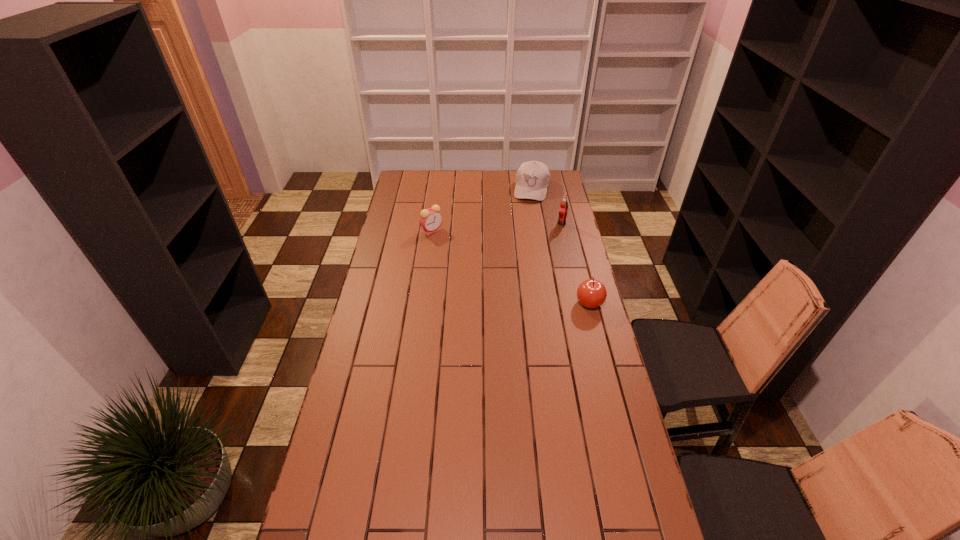
Where is `vacant space located 0.240m on the front-facing side of the baseball cap`? This screenshot has height=540, width=960. vacant space located 0.240m on the front-facing side of the baseball cap is located at coordinates (524, 230).

Where is `free location located on the front-facing side of the baseball cap`? The image size is (960, 540). free location located on the front-facing side of the baseball cap is located at coordinates (519, 248).

Where is `object that is at the far edge`? The width and height of the screenshot is (960, 540). object that is at the far edge is located at coordinates (532, 178).

Find the location of a particular element. Image resolution: width=960 pixels, height=540 pixels. apple at the right edge is located at coordinates (591, 293).

The height and width of the screenshot is (540, 960). Find the location of `soda bottle present at the right edge`. soda bottle present at the right edge is located at coordinates (563, 209).

Where is `baseball cap positioned at the right edge`? baseball cap positioned at the right edge is located at coordinates (532, 178).

Locate an element on the screen. The image size is (960, 540). object that is at the far right corner is located at coordinates (532, 178).

Where is `free space at the left edge`? Image resolution: width=960 pixels, height=540 pixels. free space at the left edge is located at coordinates (346, 494).

At what (x,y) coordinates should I click in order to perform the action: click on vacant space at the right edge of the desktop. Please return your answer as a coordinate pair (x, y). The image size is (960, 540). Looking at the image, I should click on (585, 453).

Identify the location of free spot at the far right corner of the desktop. This screenshot has height=540, width=960. (560, 180).